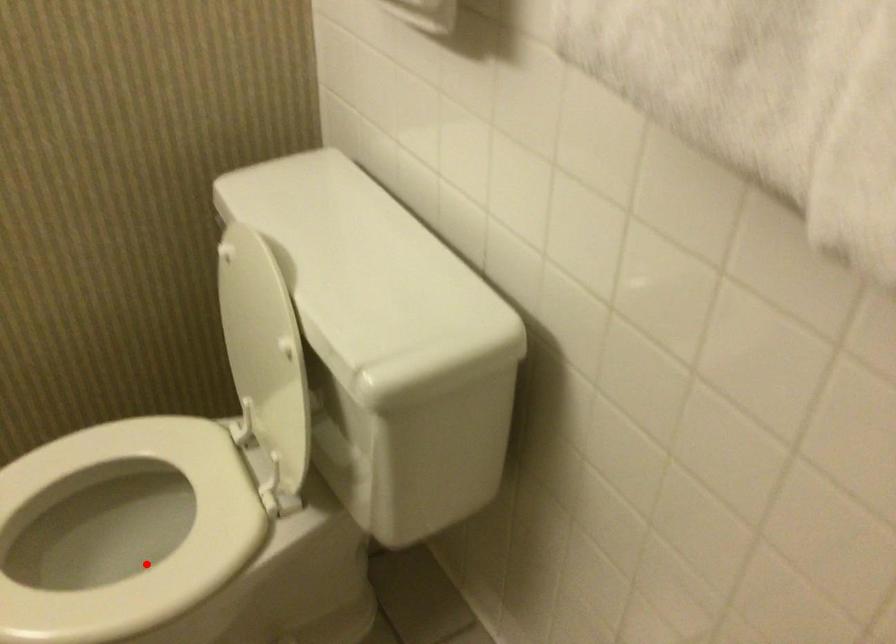
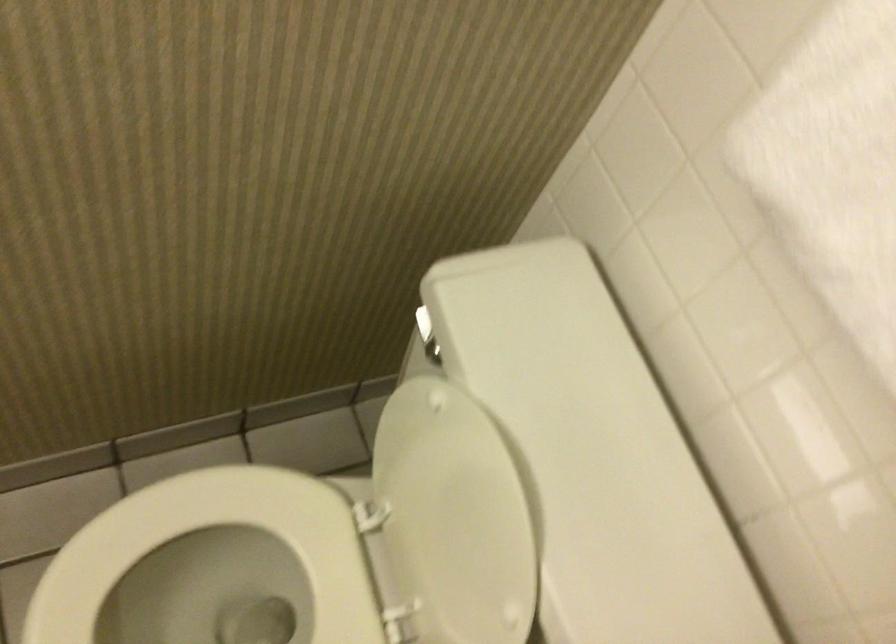
Find the pixel in the second image that matches the highlighted location in the first image.

(222, 590)